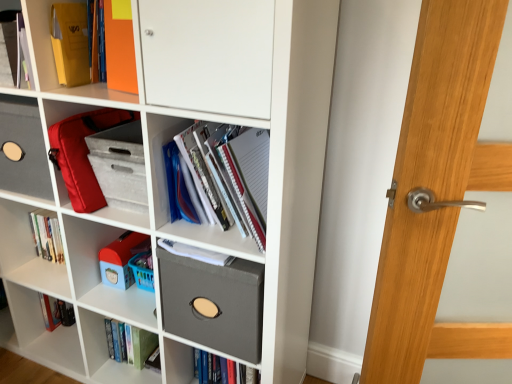
Question: Which direction should I rotate to look at matte gray fabric box at center, the 1th shelf from the right?

Choices:
 (A) right
 (B) left

Answer: (B)

Question: Can you confirm if plastic toy at lower left is smaller than matte gray fabric storage bin at center?

Choices:
 (A) no
 (B) yes

Answer: (B)

Question: Is plastic toy at lower left to the left of matte gray fabric storage bin at center from the viewer's perspective?

Choices:
 (A) no
 (B) yes

Answer: (A)

Question: From the image's perspective, would you say plastic toy at lower left is shown under matte gray fabric storage bin at center?

Choices:
 (A) yes
 (B) no

Answer: (A)

Question: Does plastic toy at lower left have a lesser height compared to matte gray fabric storage bin at center?

Choices:
 (A) yes
 (B) no

Answer: (A)

Question: From a real-world perspective, is plastic toy at lower left over matte gray fabric storage bin at center?

Choices:
 (A) yes
 (B) no

Answer: (B)

Question: Is plastic toy at lower left positioned beyond the bounds of matte gray fabric storage bin at center?

Choices:
 (A) yes
 (B) no

Answer: (B)

Question: Considering the relative sizes of matte red bag at center-left, which is the 2th shelf from left to right, and green matte book at lower center, marked as the 1th book in a bottom-to-top arrangement, in the image provided, is matte red bag at center-left, which is the 2th shelf from left to right, smaller than green matte book at lower center, marked as the 1th book in a bottom-to-top arrangement,?

Choices:
 (A) yes
 (B) no

Answer: (B)

Question: From the image's perspective, is matte red bag at center-left, the second shelf in the right-to-left sequence, above green matte book at lower center, which is counted as the 1th book, starting from the back?

Choices:
 (A) no
 (B) yes

Answer: (B)

Question: Does matte red bag at center-left, which is the second shelf in bottom-to-top order, appear on the left side of green matte book at lower center, marked as the 1th book in a bottom-to-top arrangement?

Choices:
 (A) yes
 (B) no

Answer: (A)

Question: Does matte red bag at center-left, which is the 2th shelf from left to right, have a lesser width compared to green matte book at lower center, arranged as the 2th book when viewed from the top?

Choices:
 (A) no
 (B) yes

Answer: (A)

Question: Does matte red bag at center-left, the second shelf in the right-to-left sequence, have a greater height compared to green matte book at lower center, the 2th book viewed from the right?

Choices:
 (A) no
 (B) yes

Answer: (B)

Question: Can you confirm if matte red bag at center-left, the second shelf in the right-to-left sequence, is wider than green matte book at lower center, the 2th book viewed from the right?

Choices:
 (A) yes
 (B) no

Answer: (A)

Question: Is matte red bag at center-left, the second shelf in the right-to-left sequence, oriented towards orange matte folder at upper left, placed as the 1th shelf when sorted from top to bottom?

Choices:
 (A) no
 (B) yes

Answer: (A)